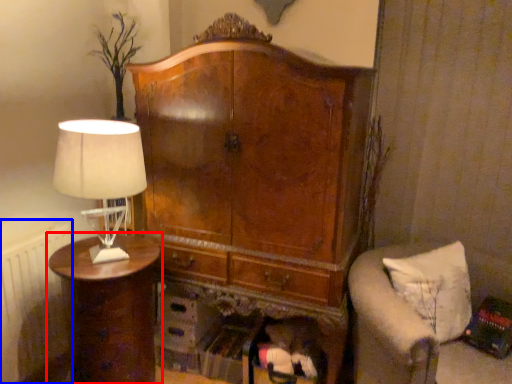
Question: Which point is closer to the camera, nightstand (highlighted by a red box) or radiator (highlighted by a blue box)?

Choices:
 (A) nightstand
 (B) radiator

Answer: (A)